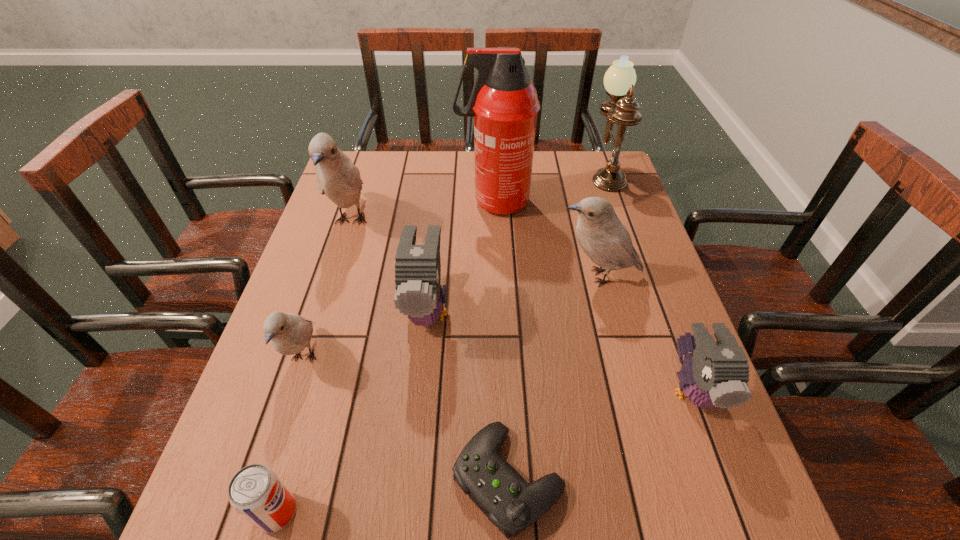
Where is `object at the far right corner`? object at the far right corner is located at coordinates (619, 80).

In the image, there is a desktop. At what (x,y) coordinates should I click in order to perform the action: click on vacant space at the far edge. Please return your answer as a coordinate pair (x, y). The width and height of the screenshot is (960, 540). Looking at the image, I should click on (410, 180).

You are a GUI agent. You are given a task and a screenshot of the screen. Output one action in this format:
    pyautogui.click(x=<x>, y=<y>)
    Task: Click on the vacant space at the left edge
    The height and width of the screenshot is (540, 960).
    Given the screenshot: What is the action you would take?
    pyautogui.click(x=348, y=209)

Locate an element on the screen. vacant space at the far right corner of the desktop is located at coordinates (602, 161).

The height and width of the screenshot is (540, 960). In order to click on vacant area at the near right corner of the desktop in this screenshot , I will do coord(700,520).

The width and height of the screenshot is (960, 540). Identify the location of empty location between the nearest white bird and the rightmost white bird. (451, 317).

This screenshot has height=540, width=960. Find the location of `empty space between the farthest white bird and the smallest white bird`. empty space between the farthest white bird and the smallest white bird is located at coordinates (327, 289).

I want to click on free space between the biggest white bird and the fire extinguisher, so click(x=422, y=212).

Where is `free space between the second biggest white bird and the farthest bird`? The height and width of the screenshot is (540, 960). free space between the second biggest white bird and the farthest bird is located at coordinates (474, 249).

Where is `free spot between the right gray bird and the oil lamp`? free spot between the right gray bird and the oil lamp is located at coordinates (648, 281).